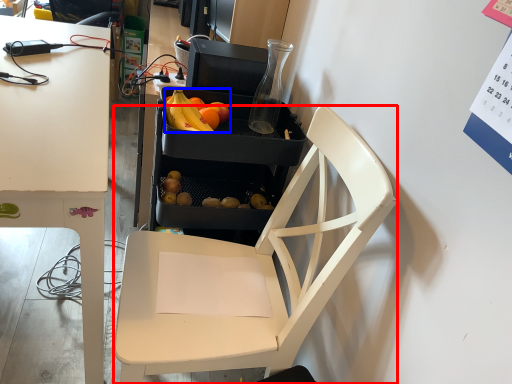
Question: Which of the following is the closest to the observer, chair (highlighted by a red box) or grapefruit (highlighted by a blue box)?

Choices:
 (A) chair
 (B) grapefruit

Answer: (A)